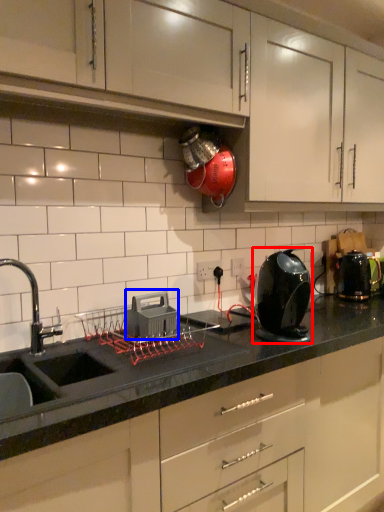
Question: Which of the following is the closest to the observer, home appliance (highlighted by a red box) or appliance (highlighted by a blue box)?

Choices:
 (A) home appliance
 (B) appliance

Answer: (A)